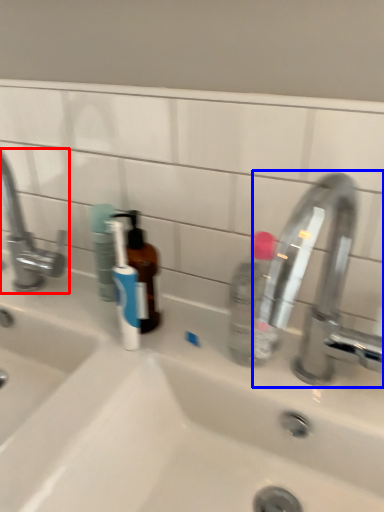
Question: Which point is closer to the camera, tap (highlighted by a red box) or tap (highlighted by a blue box)?

Choices:
 (A) tap
 (B) tap

Answer: (B)